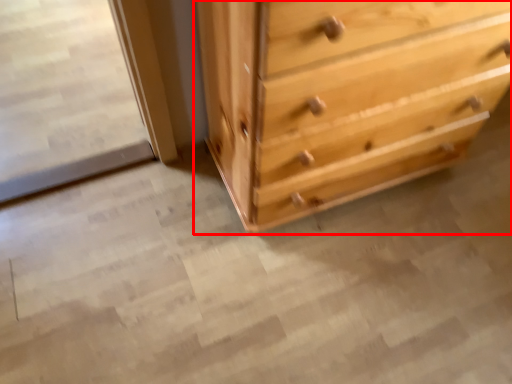
Question: Where is chest of drawers (annotated by the red box) located in relation to screen door in the image?

Choices:
 (A) right
 (B) left

Answer: (A)